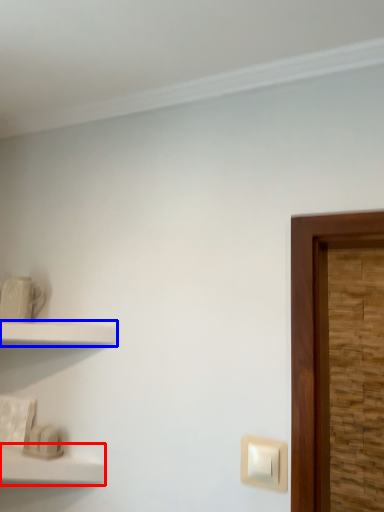
Question: Which object appears farthest to the camera in this image, shelf (highlighted by a red box) or shelf (highlighted by a blue box)?

Choices:
 (A) shelf
 (B) shelf

Answer: (B)